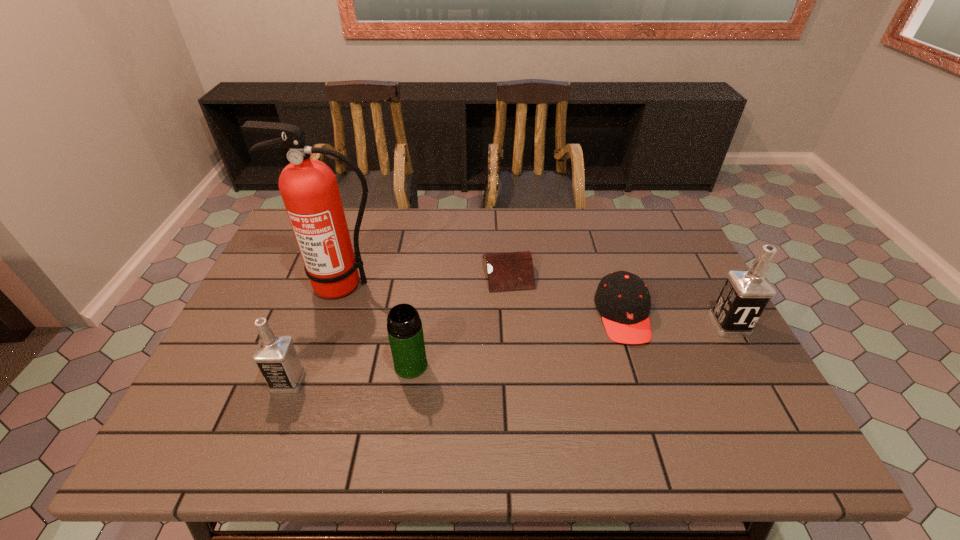
Identify the location of vacant area that lies between the thermos bottle and the book. Image resolution: width=960 pixels, height=540 pixels. (459, 318).

Where is `free area in between the third object from right to left and the fire extinguisher`? free area in between the third object from right to left and the fire extinguisher is located at coordinates (425, 279).

Identify the location of vacant space in between the fifth tallest object and the tallest object. (483, 300).

The height and width of the screenshot is (540, 960). Identify the location of free spot between the book and the tallest object. (425, 279).

Identify the location of vacant area between the fire extinguisher and the second object from right to left. This screenshot has width=960, height=540. (483, 300).

Locate an element on the screen. Image resolution: width=960 pixels, height=540 pixels. free space between the second object from right to left and the nearer vodka is located at coordinates click(x=456, y=348).

Locate an element on the screen. This screenshot has width=960, height=540. vacant area that lies between the thermos bottle and the left vodka is located at coordinates (349, 373).

The image size is (960, 540). Find the location of `vacant space in between the tallest object and the shortest object`. vacant space in between the tallest object and the shortest object is located at coordinates (425, 279).

I want to click on object that is the fifth nearest to the left vodka, so click(x=746, y=293).

Choose which object is the fifth nearest neighbor to the taller vodka. Please provide its 2D coordinates. Your answer should be formatted as a tuple, i.e. [(x, y)], where the tuple contains the x and y coordinates of a point satisfying the conditions above.

[(275, 355)]